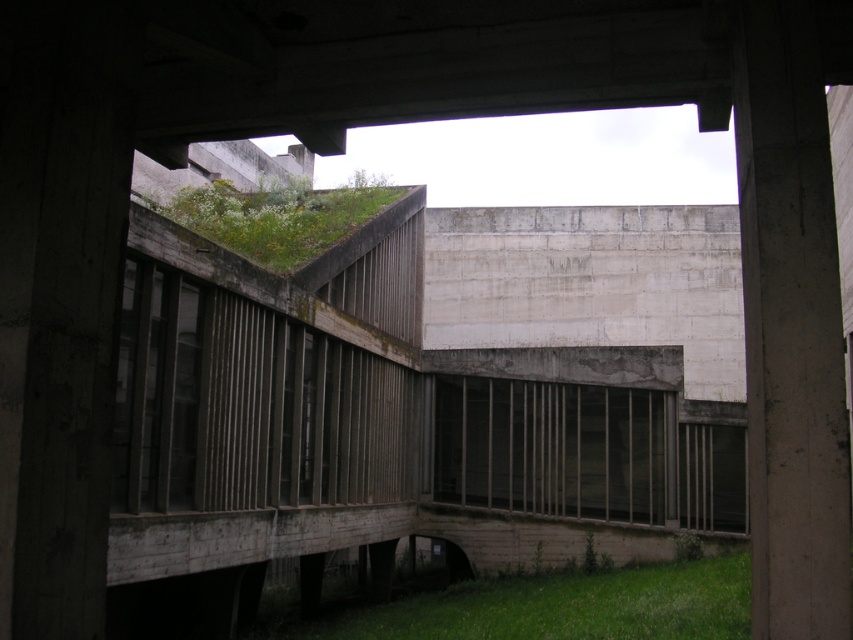
Question: Which point appears closest to the camera in this image?

Choices:
 (A) (218, 192)
 (B) (758, 636)

Answer: (B)

Question: Does gray concrete pillar at right have a lesser width compared to green grass at lower right?

Choices:
 (A) no
 (B) yes

Answer: (B)

Question: Does green grass at lower right appear under green mossy roof at upper center?

Choices:
 (A) yes
 (B) no

Answer: (A)

Question: Estimate the real-world distances between objects in this image. Which object is closer to the green mossy roof at upper center?

Choices:
 (A) gray concrete pillar at right
 (B) green grass at lower right

Answer: (B)

Question: Is the position of green grass at lower right more distant than that of green mossy roof at upper center?

Choices:
 (A) yes
 (B) no

Answer: (B)

Question: Considering the real-world distances, which object is farthest from the gray concrete pillar at right?

Choices:
 (A) green mossy roof at upper center
 (B) green grass at lower right

Answer: (A)